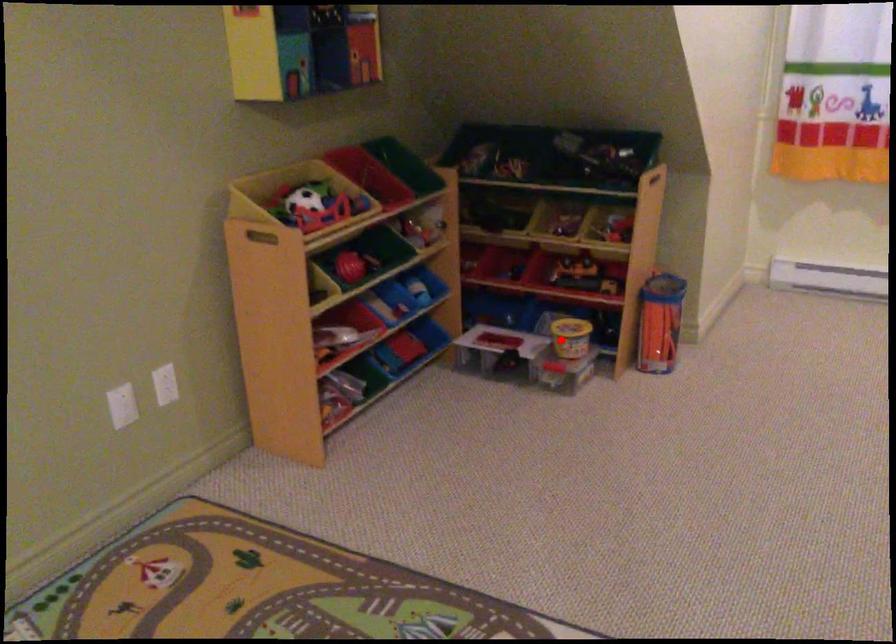
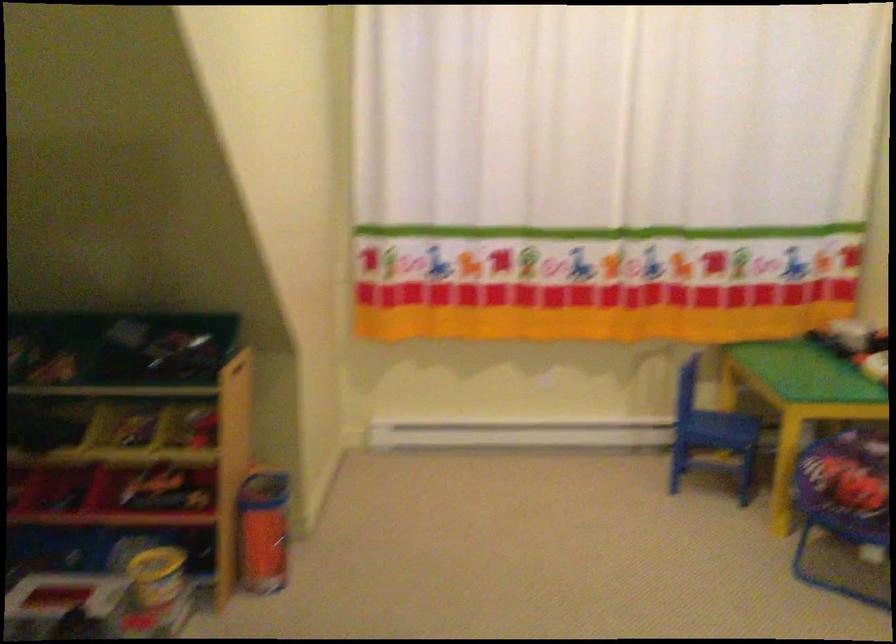
Question: I am providing you with two images of the same scene from different viewpoints. Image1 has a red point marked. In image2, the corresponding 3D location appears at what relative position? Reply with the corresponding letter.

Choices:
 (A) Closer
 (B) Farther

Answer: (A)